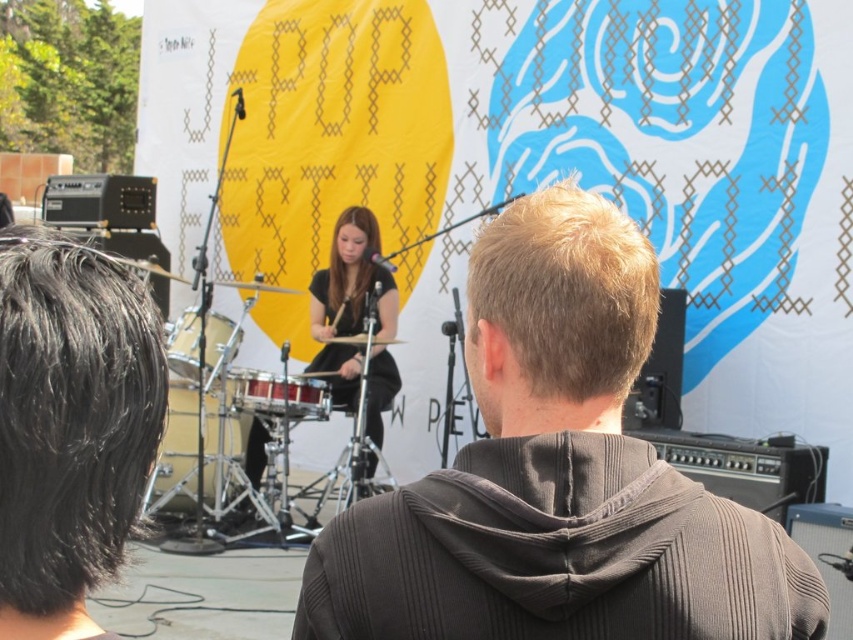
Question: Is matte black drum set at center below metallic silver drum at lower left?

Choices:
 (A) no
 (B) yes

Answer: (A)

Question: Which point is farther to the camera?

Choices:
 (A) (288, 412)
 (B) (238, 440)

Answer: (B)

Question: Which point is farther from the camera taking this photo?

Choices:
 (A) (216, 394)
 (B) (708, 493)

Answer: (A)

Question: Can you confirm if shiny silver drum at center is smaller than shiny red drum at center?

Choices:
 (A) no
 (B) yes

Answer: (A)

Question: Estimate the real-world distances between objects in this image. Which object is closer to the matte black drum set at center?

Choices:
 (A) shiny red drum at center
 (B) metallic silver drum at lower left
 (C) shiny silver drum at center

Answer: (A)

Question: Is matte black drum set at center to the left of metallic silver drum at lower left from the viewer's perspective?

Choices:
 (A) no
 (B) yes

Answer: (A)